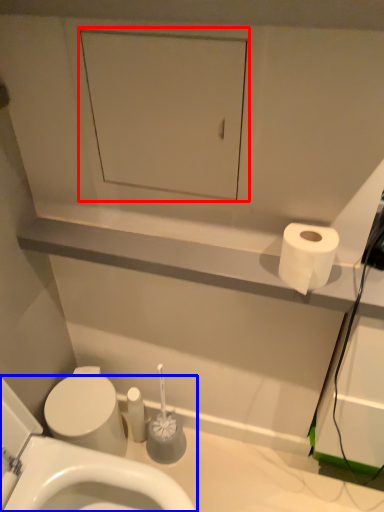
Question: Which object appears closest to the camera in this image, medicine cabinet (highlighted by a red box) or toilet (highlighted by a blue box)?

Choices:
 (A) medicine cabinet
 (B) toilet

Answer: (B)